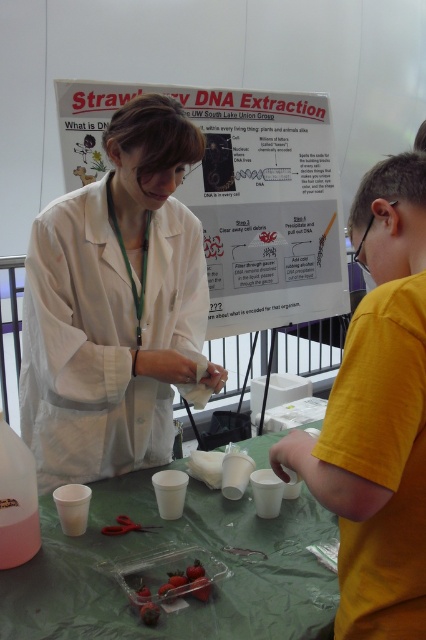
You are a student observing the DNA extraction demonstration. The teacher asks you to describe the spatial relationship between the white lab coat at center and the white paperboard at center. Which object is located to the left?

The white lab coat at center is positioned on the left side of the white paperboard at center.

You are organizing a science fair and need to ensure that the white lab coat at center can be displayed on a hanger without touching the green plastic table at center. Given that the lab coat is narrower than the table, will the coat fit on the hanger without overlapping the table?

The white lab coat at center is narrower than the green plastic table at center, so it should fit on the hanger without overlapping the table.